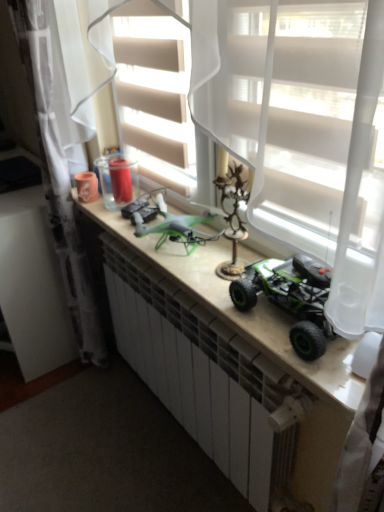
Question: Do you think matte white counter at center is within white sheer curtain at upper left, which is the first curtain in left-to-right order, or outside of it?

Choices:
 (A) outside
 (B) inside

Answer: (A)

Question: Is matte white counter at center taller or shorter than white sheer curtain at upper left, marked as the 2th curtain in a right-to-left arrangement?

Choices:
 (A) short
 (B) tall

Answer: (A)

Question: Based on their relative distances, which object is farther from the white sheer curtain at center, positioned as the 1th curtain in right-to-left order?

Choices:
 (A) white sheer curtain at upper left, which is the first curtain in left-to-right order
 (B) matte white counter at center

Answer: (A)

Question: Which of these objects is positioned farthest from the white sheer curtain at upper left, marked as the 2th curtain in a right-to-left arrangement?

Choices:
 (A) matte white counter at center
 (B) white sheer curtain at center, the second curtain from the left

Answer: (B)